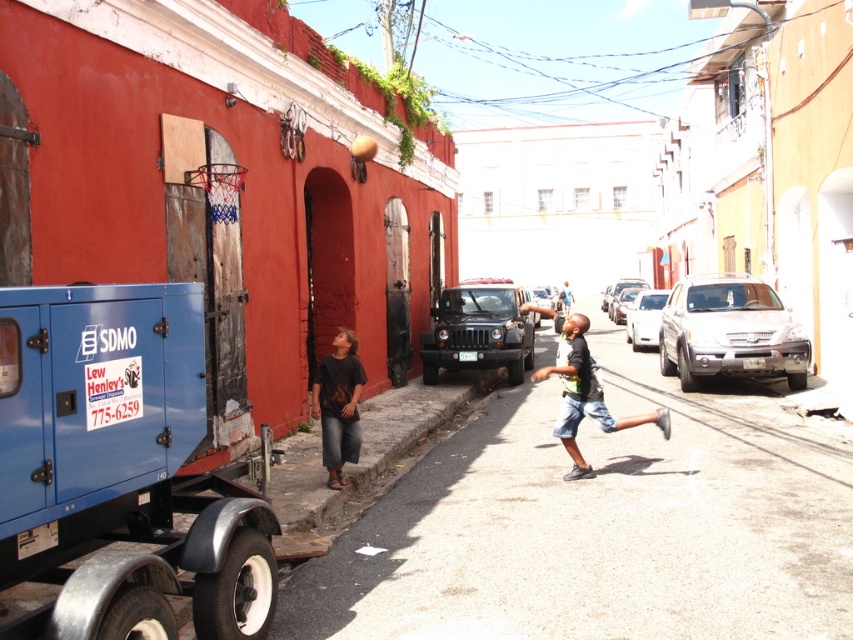
Who is more forward, (527,493) or (343,451)?

Point (527,493) is more forward.

Does black t-shirt at center have a larger size compared to dark gray jeans at lower left?

Indeed, black t-shirt at center has a larger size compared to dark gray jeans at lower left.

Is point (537, 513) closer to viewer compared to point (323, 394)?

Yes, point (537, 513) is in front of point (323, 394).

Where is `black t-shirt at center`? Image resolution: width=853 pixels, height=640 pixels. black t-shirt at center is located at coordinates (601, 524).

Is matte black suv at center smaller than dark blue denim shorts at center?

Correct, matte black suv at center occupies less space than dark blue denim shorts at center.

In the scene shown: Between matte black suv at center and dark blue denim shorts at center, which one appears on the left side from the viewer's perspective?

From the viewer's perspective, matte black suv at center appears more on the left side.

Image resolution: width=853 pixels, height=640 pixels. Identify the location of matte black suv at center. (479, 332).

Can you confirm if matte black suv at center is shorter than dark gray jeans at lower left?

Yes, matte black suv at center is shorter than dark gray jeans at lower left.

Does matte black suv at center lie behind dark gray jeans at lower left?

Yes, it is.

Where is `matte black suv at center`? This screenshot has width=853, height=640. matte black suv at center is located at coordinates (479, 332).

I want to click on matte black suv at center, so click(x=479, y=332).